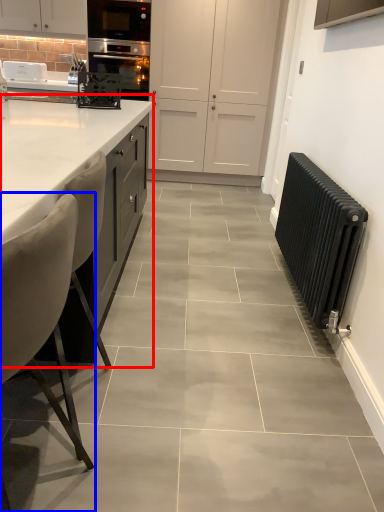
Question: Which point is further to the camera, countertop (highlighted by a red box) or chair (highlighted by a blue box)?

Choices:
 (A) countertop
 (B) chair

Answer: (A)